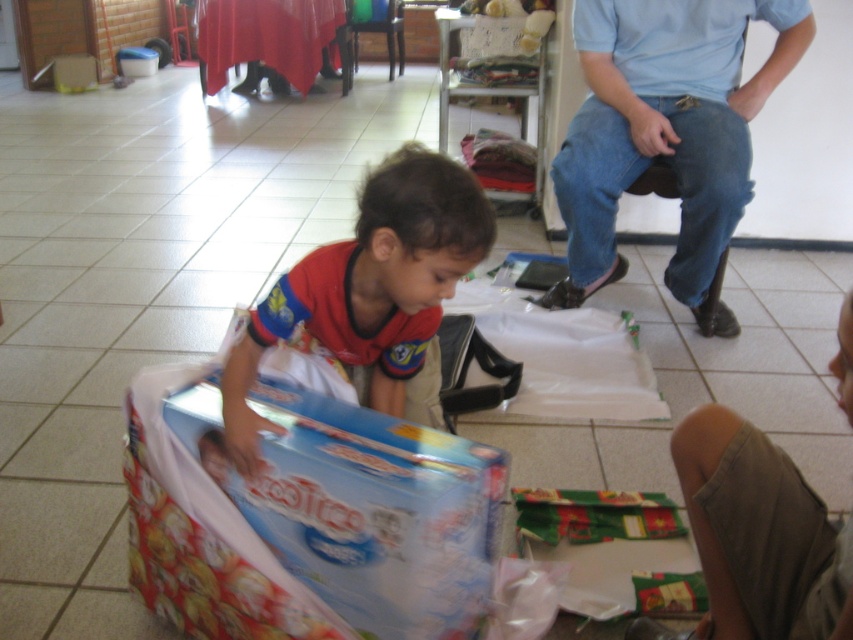
You are standing in the room and want to hand a gift to both the blue jeans at upper right and the matte red shirt at center. Which person should you approach first to ensure you can reach them without moving closer?

You should approach the blue jeans at upper right first because they are closer to you than the matte red shirt at center.

You are a photographer trying to capture a candid shot of the children unwrapping gifts. You need to ensure that both the matte red shirt at center and the khaki cotton shorts at lower right are clearly visible in the frame. Based on their sizes, which object should you focus on to ensure both are in focus?

The matte red shirt at center is larger in size than the khaki cotton shorts at lower right. To ensure both are in focus, you should focus on the matte red shirt at center as it is larger and will be easier to capture clearly, allowing the smaller khaki cotton shorts at lower right to remain in the frame.